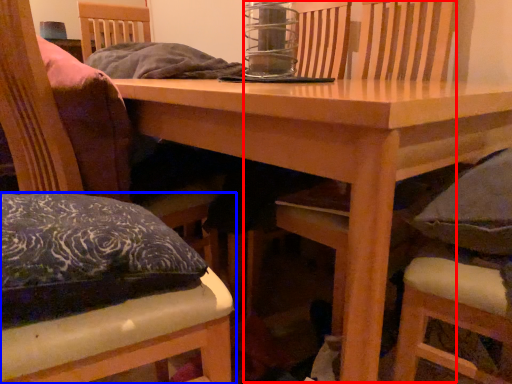
Question: Which of the following is the farthest to the observer, armchair (highlighted by a red box) or chair (highlighted by a blue box)?

Choices:
 (A) armchair
 (B) chair

Answer: (A)